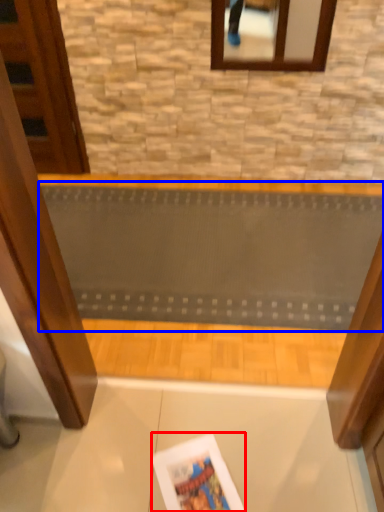
Question: Which of the following is the closest to the observer, magazine (highlighted by a red box) or ramp (highlighted by a blue box)?

Choices:
 (A) magazine
 (B) ramp

Answer: (A)